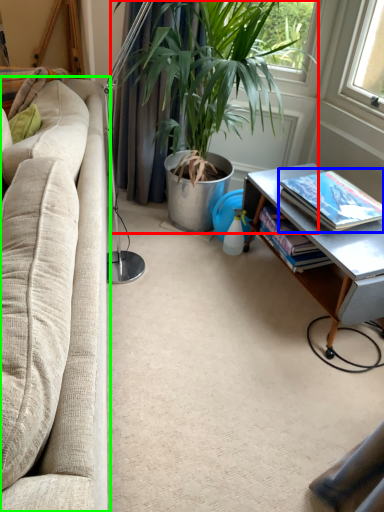
Question: Which object is the farthest from houseplant (highlighted by a red box)? Choose among these: book (highlighted by a blue box) or studio couch (highlighted by a green box).

Choices:
 (A) book
 (B) studio couch

Answer: (A)